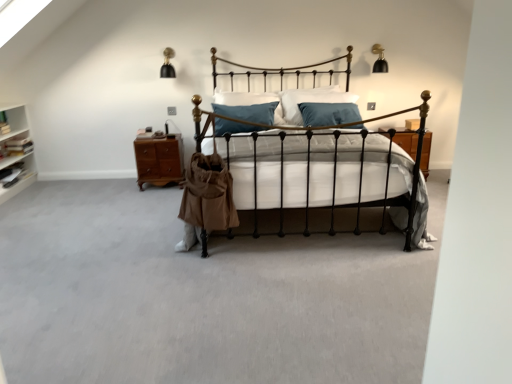
Question: From the image's perspective, is brown wood nightstand at left on top of blue velvet pillow at center?

Choices:
 (A) no
 (B) yes

Answer: (A)

Question: From a real-world perspective, does brown wood nightstand at left stand above blue velvet pillow at center?

Choices:
 (A) no
 (B) yes

Answer: (A)

Question: Is brown wood nightstand at left smaller than blue velvet pillow at center?

Choices:
 (A) no
 (B) yes

Answer: (B)

Question: From the image's perspective, is brown wood nightstand at left beneath blue velvet pillow at center?

Choices:
 (A) yes
 (B) no

Answer: (A)

Question: Can you confirm if brown wood nightstand at left is shorter than blue velvet pillow at center?

Choices:
 (A) no
 (B) yes

Answer: (A)

Question: Looking at their shapes, would you say blue velvet pillow at center is wider or thinner than black wrought iron bed at center?

Choices:
 (A) thin
 (B) wide

Answer: (A)

Question: Considering the relative positions of blue velvet pillow at center and black wrought iron bed at center in the image provided, is blue velvet pillow at center to the left or to the right of black wrought iron bed at center?

Choices:
 (A) right
 (B) left

Answer: (B)

Question: Considering their positions, is blue velvet pillow at center located in front of or behind black wrought iron bed at center?

Choices:
 (A) behind
 (B) front

Answer: (A)

Question: Which is correct: blue velvet pillow at center is inside black wrought iron bed at center, or outside of it?

Choices:
 (A) outside
 (B) inside

Answer: (A)

Question: From the image's perspective, is black wrought iron bed at center above or below blue velvet pillow at center?

Choices:
 (A) below
 (B) above

Answer: (A)

Question: Does point (372, 192) appear closer or farther from the camera than point (222, 94)?

Choices:
 (A) closer
 (B) farther

Answer: (A)

Question: Considering the relative positions of black wrought iron bed at center and blue velvet pillow at center in the image provided, is black wrought iron bed at center to the left or to the right of blue velvet pillow at center?

Choices:
 (A) right
 (B) left

Answer: (A)

Question: Is black wrought iron bed at center in front of or behind blue velvet pillow at center in the image?

Choices:
 (A) front
 (B) behind

Answer: (A)

Question: Is point (249, 104) positioned closer to the camera than point (159, 150)?

Choices:
 (A) closer
 (B) farther

Answer: (A)

Question: From a real-world perspective, is blue velvet pillow at center positioned above or below brown wood nightstand at left?

Choices:
 (A) above
 (B) below

Answer: (A)